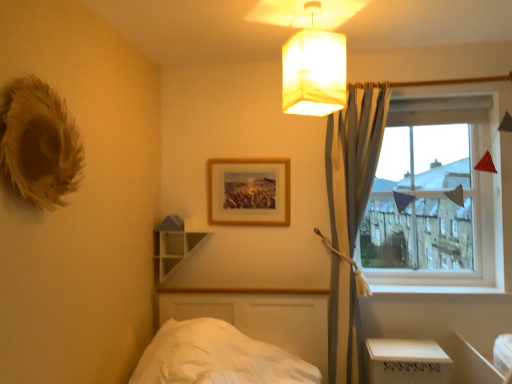
Question: Considering the positions of point (497, 92) and point (402, 364), is point (497, 92) closer or farther from the camera than point (402, 364)?

Choices:
 (A) closer
 (B) farther

Answer: (B)

Question: Is clear glass window at right taller or shorter than white plastic table at lower right?

Choices:
 (A) short
 (B) tall

Answer: (B)

Question: Which object is positioned farthest from the white plastic table at lower right?

Choices:
 (A) wooden picture frame at upper center
 (B) clear glass window at right
 (C) light gray fabric curtain at upper right
 (D) matte white lampshade at upper center
 (E) green matte shelf at upper center

Answer: (D)

Question: Which of these objects is positioned farthest from the matte white lampshade at upper center?

Choices:
 (A) clear glass window at right
 (B) green matte shelf at upper center
 (C) light gray fabric curtain at upper right
 (D) white plastic table at lower right
 (E) wooden picture frame at upper center

Answer: (D)